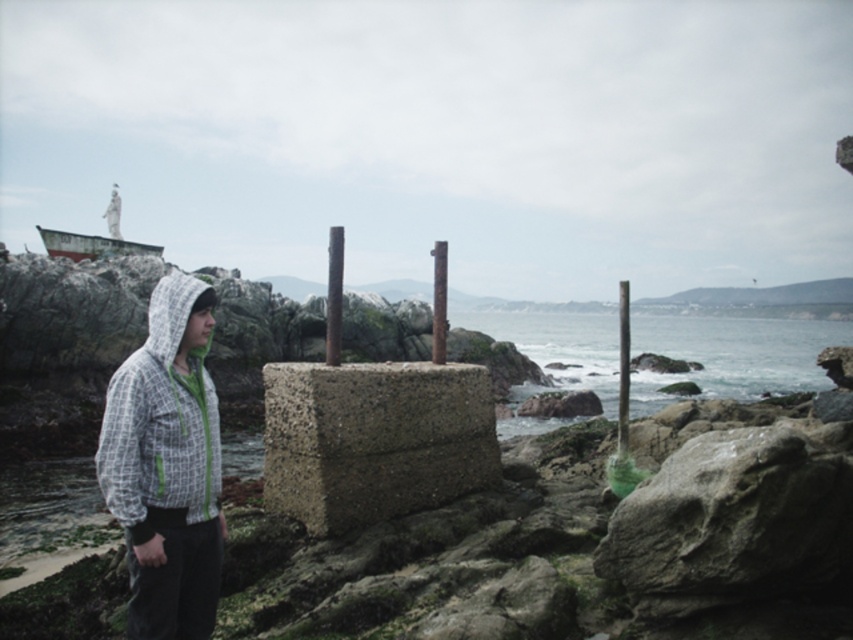
Who is lower down, gray concrete block at center or white checkered hoodie at left?

gray concrete block at center is lower down.

Who is taller, gray concrete block at center or white checkered hoodie at left?

white checkered hoodie at left is taller.

Is point (322, 429) farther from viewer compared to point (140, 388)?

Yes, point (322, 429) is behind point (140, 388).

I want to click on gray concrete block at center, so click(374, 440).

Can you confirm if gray rough rock at lower right is bigger than smooth concrete pillar at center?

Incorrect, gray rough rock at lower right is not larger than smooth concrete pillar at center.

The image size is (853, 640). Find the location of `gray rough rock at lower right`. gray rough rock at lower right is located at coordinates (734, 520).

Is point (717, 451) positioned in front of point (440, 310)?

That is True.

This screenshot has width=853, height=640. I want to click on gray rough rock at lower right, so click(734, 520).

Identify the location of brown wood post at center. This screenshot has height=640, width=853. (334, 296).

Does point (334, 292) come farther from viewer compared to point (624, 392)?

That is False.

Find the location of a particular element. This screenshot has width=853, height=640. brown wood post at center is located at coordinates (334, 296).